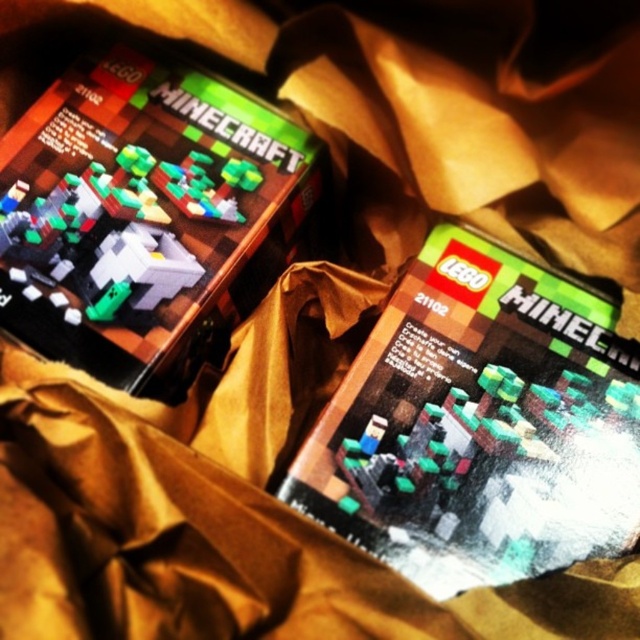
Consider the image. Does matte black lego minecraft set at center appear under matte plastic lego minecraft set at center?

No.

Is matte black lego minecraft set at center taller than matte plastic lego minecraft set at center?

Yes, matte black lego minecraft set at center is taller than matte plastic lego minecraft set at center.

Does point (376, 378) come in front of point (348, 513)?

No, it is not.

Locate an element on the screen. matte black lego minecraft set at center is located at coordinates (480, 424).

Is matte cardboard lego minecraft set at upper left positioned before matte plastic lego minecraft set at center?

No, it is behind matte plastic lego minecraft set at center.

Can you confirm if matte cardboard lego minecraft set at upper left is positioned above matte plastic lego minecraft set at center?

Yes.

Between point (243, 250) and point (360, 506), which one is positioned behind?

The point (243, 250) is more distant.

Find the location of `matte cardboard lego minecraft set at upper left`. matte cardboard lego minecraft set at upper left is located at coordinates (145, 216).

Does matte black lego minecraft set at center have a smaller size compared to matte cardboard lego minecraft set at upper left?

Yes.

Describe the element at coordinates (480, 424) in the screenshot. I see `matte black lego minecraft set at center` at that location.

What are the coordinates of `matte black lego minecraft set at center` in the screenshot? It's located at (480, 424).